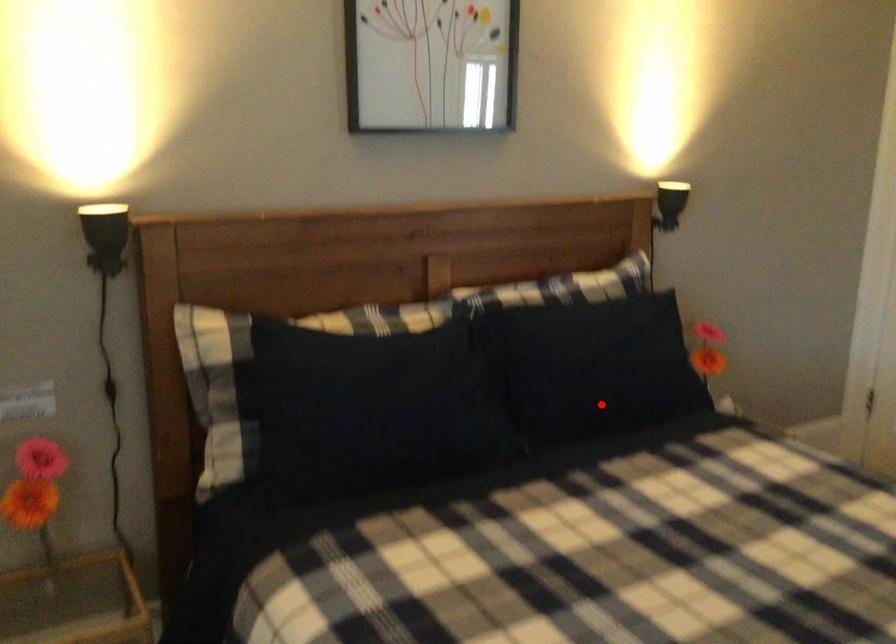
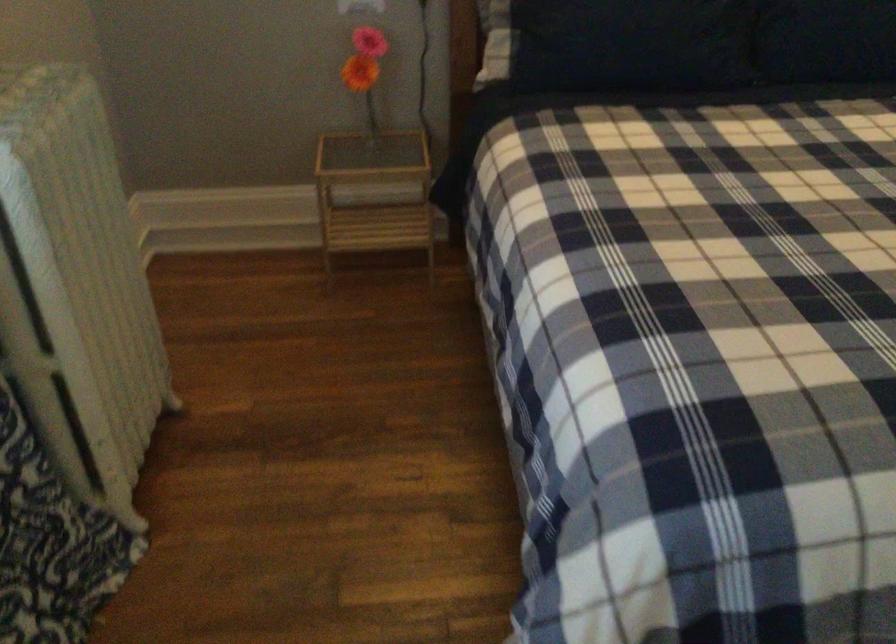
Question: I am providing you with two images of the same scene from different viewpoints. A red point is marked on the first image. At the location where the point appears in image 1, is it still visible in image 2?

Choices:
 (A) Yes
 (B) No

Answer: (A)